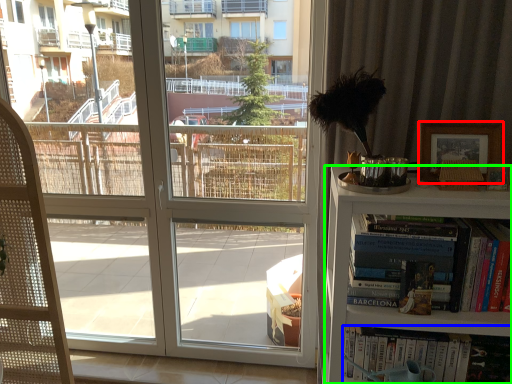
Question: Which object is positioned farthest from picture frame (highlighted by a red box)? Select from book (highlighted by a blue box) and bookcase (highlighted by a green box).

Choices:
 (A) book
 (B) bookcase

Answer: (A)